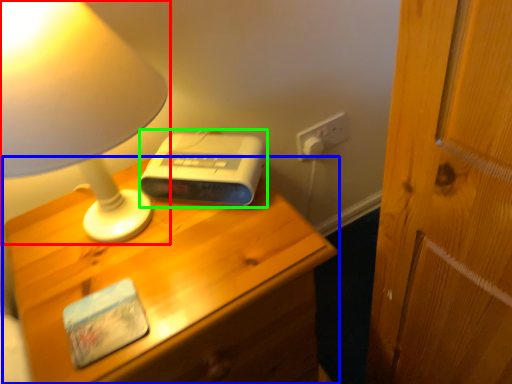
Question: Considering the real-world distances, which object is farthest from lamp (highlighted by a red box)? nightstand (highlighted by a blue box) or gadget (highlighted by a green box)?

Choices:
 (A) nightstand
 (B) gadget

Answer: (A)